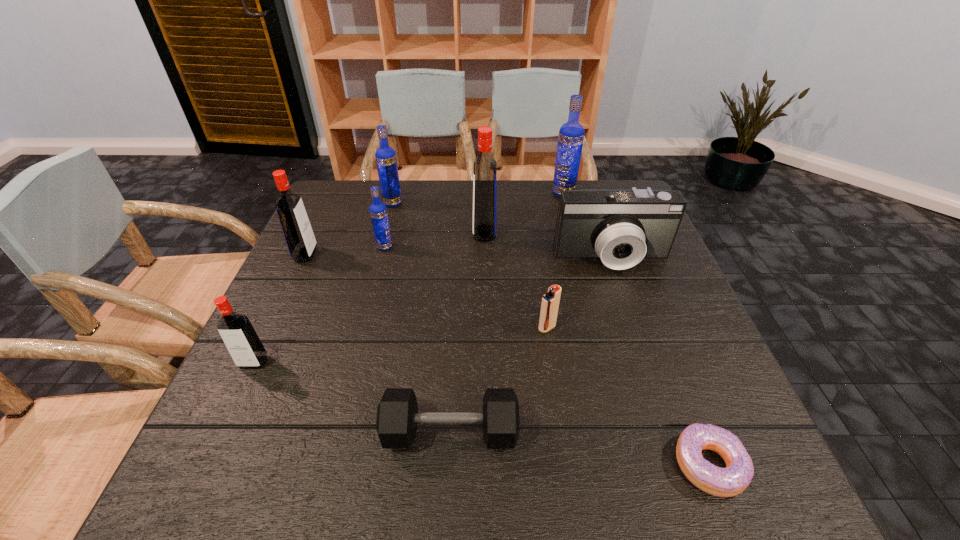
Select which blue vodka appears as the closest to the seventh farthest object. Please provide its 2D coordinates. Your answer should be formatted as a tuple, i.e. [(x, y)], where the tuple contains the x and y coordinates of a point satisfying the conditions above.

[(378, 211)]

The height and width of the screenshot is (540, 960). I want to click on blue vodka that stands as the closest to the second biggest blue vodka, so click(x=378, y=211).

Identify which red vodka is the closest to the biggest blue vodka. Please provide its 2D coordinates. Your answer should be formatted as a tuple, i.e. [(x, y)], where the tuple contains the x and y coordinates of a point satisfying the conditions above.

[(485, 172)]

Choose which red vodka is the nearest neighbor to the igniter. Please provide its 2D coordinates. Your answer should be formatted as a tuple, i.e. [(x, y)], where the tuple contains the x and y coordinates of a point satisfying the conditions above.

[(485, 172)]

Locate an element on the screen. blank area in the image that satisfies the following two spatial constraints: 1. on the front side of the shortest object; 2. on the right side of the rightmost vodka is located at coordinates (636, 464).

Locate an element on the screen. The image size is (960, 540). free location that satisfies the following two spatial constraints: 1. on the front and back of the third nearest object; 2. on the left side of the purple doughnut is located at coordinates (206, 464).

What are the coordinates of `free location that satisfies the following two spatial constraints: 1. on the front and back of the second vodka from right to left; 2. on the front and back of the nearest vodka` in the screenshot? It's located at (486, 362).